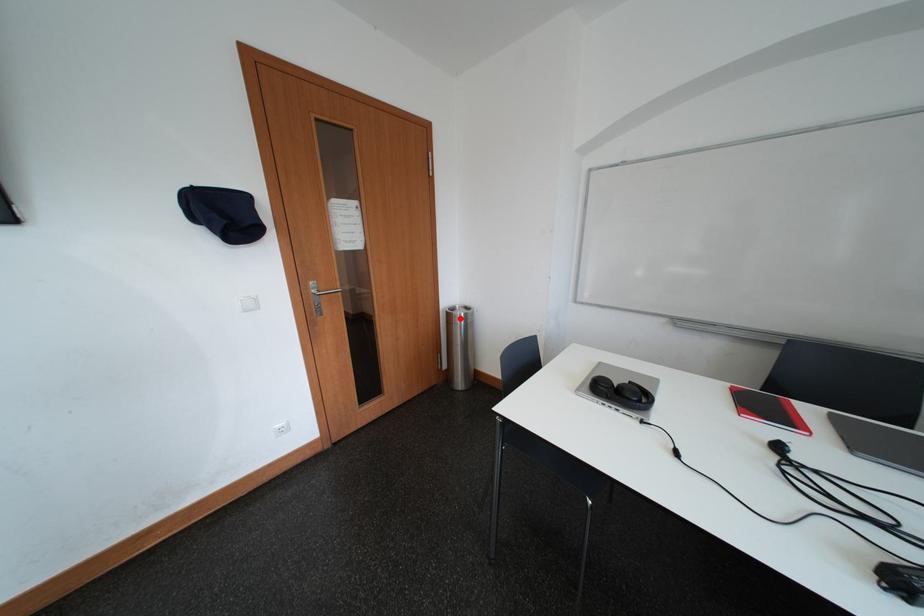
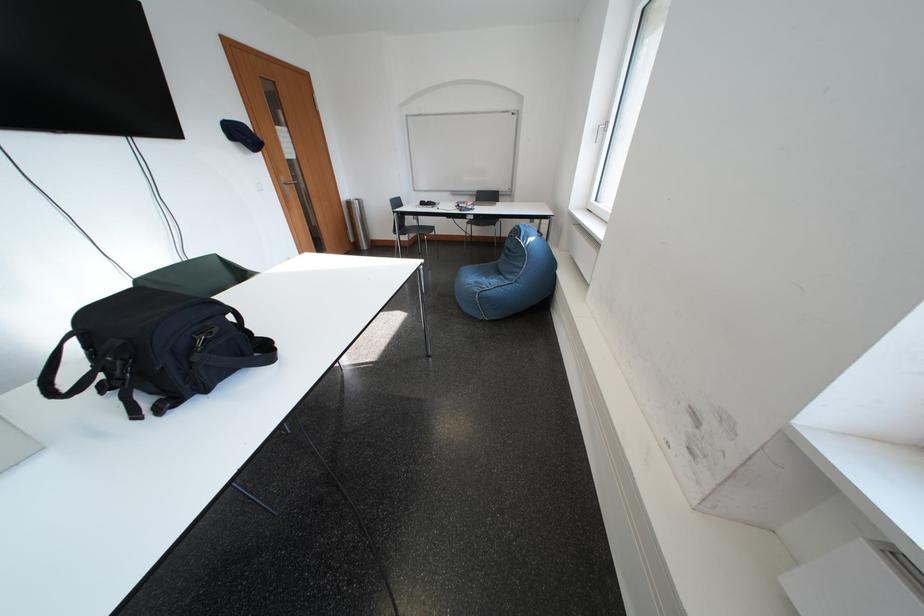
The point at the highlighted location is marked in the first image. Where is the corresponding point in the second image?

(360, 207)